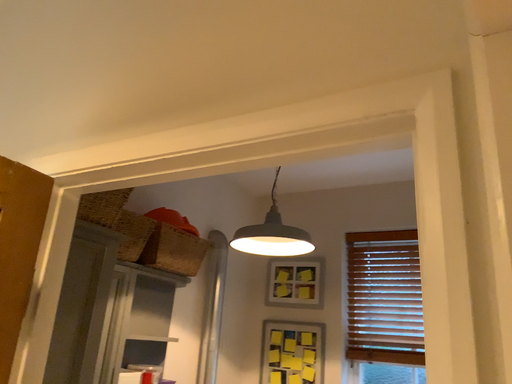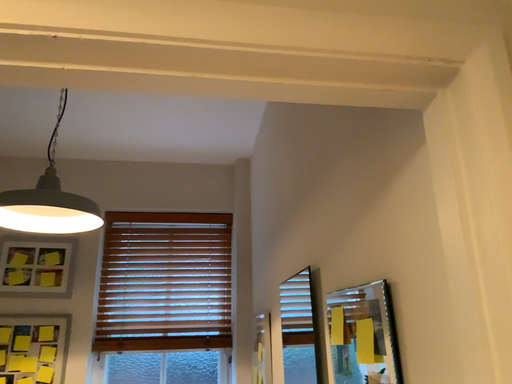
Question: How did the camera likely rotate when shooting the video?

Choices:
 (A) rotated right
 (B) rotated left

Answer: (A)